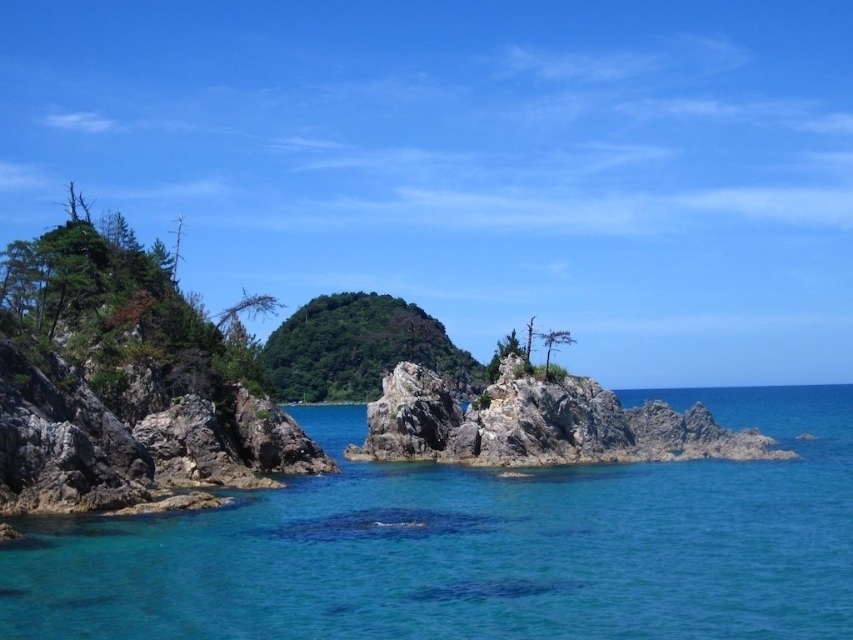
Is point (157, 337) closer to viewer compared to point (474, 384)?

Yes, point (157, 337) is closer to viewer.

Does green matte tree at left have a lesser width compared to green leafy tree at center?

No, green matte tree at left is not thinner than green leafy tree at center.

Is point (18, 243) positioned after point (271, 360)?

No, (18, 243) is in front of (271, 360).

Image resolution: width=853 pixels, height=640 pixels. What are the coordinates of `green matte tree at left` in the screenshot? It's located at (115, 298).

Is the position of rocky at center less distant than that of green matte tree at left?

No, rocky at center is further to the viewer.

Is rocky at center positioned behind green matte tree at left?

Yes, it is behind green matte tree at left.

Does point (560, 403) lie in front of point (97, 273)?

No, it is behind (97, 273).

Find the location of a particular element. Image resolution: width=853 pixels, height=640 pixels. rocky at center is located at coordinates (538, 424).

Is rocky at center closer to camera compared to green leafy tree at center?

Yes, rocky at center is closer to the viewer.

In the scene shown: Does rocky at center have a greater width compared to green leafy tree at center?

No, rocky at center is not wider than green leafy tree at center.

Which is in front, point (506, 424) or point (299, 314)?

Point (506, 424)

The width and height of the screenshot is (853, 640). What are the coordinates of `rocky at center` in the screenshot? It's located at (538, 424).